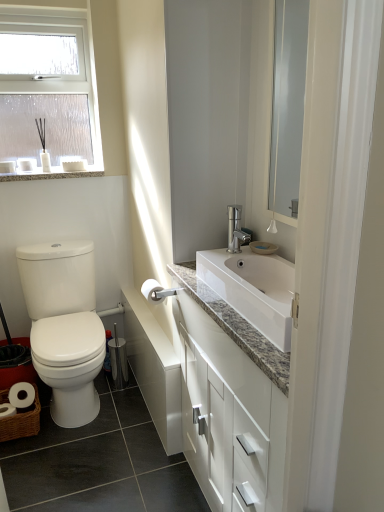
Question: From the image's perspective, is frosted glass window at upper left located beneath granite countertop at upper left?

Choices:
 (A) yes
 (B) no

Answer: (B)

Question: Considering the relative positions of frosted glass window at upper left and granite countertop at upper left in the image provided, is frosted glass window at upper left to the right of granite countertop at upper left from the viewer's perspective?

Choices:
 (A) no
 (B) yes

Answer: (A)

Question: Is there a large distance between frosted glass window at upper left and granite countertop at upper left?

Choices:
 (A) no
 (B) yes

Answer: (A)

Question: Can you confirm if frosted glass window at upper left is taller than granite countertop at upper left?

Choices:
 (A) yes
 (B) no

Answer: (A)

Question: Does frosted glass window at upper left turn towards granite countertop at upper left?

Choices:
 (A) yes
 (B) no

Answer: (A)

Question: Considering the positions of point (91, 288) and point (248, 374), is point (91, 288) closer or farther from the camera than point (248, 374)?

Choices:
 (A) farther
 (B) closer

Answer: (A)

Question: From their relative heights in the image, would you say white glossy toilet at left is taller or shorter than white glossy cabinet at center?

Choices:
 (A) short
 (B) tall

Answer: (A)

Question: Is white glossy toilet at left to the left or to the right of white glossy cabinet at center in the image?

Choices:
 (A) right
 (B) left

Answer: (B)

Question: Looking at their shapes, would you say white glossy toilet at left is wider or thinner than white glossy cabinet at center?

Choices:
 (A) wide
 (B) thin

Answer: (A)

Question: Considering their positions, is granite countertop at upper left located in front of or behind white glossy toilet at left?

Choices:
 (A) behind
 (B) front

Answer: (A)

Question: From a real-world perspective, is granite countertop at upper left physically located above or below white glossy toilet at left?

Choices:
 (A) below
 (B) above

Answer: (B)

Question: Choose the correct answer: Is granite countertop at upper left inside white glossy toilet at left or outside it?

Choices:
 (A) outside
 (B) inside

Answer: (A)

Question: From the image's perspective, is granite countertop at upper left above or below white glossy toilet at left?

Choices:
 (A) below
 (B) above

Answer: (B)

Question: From the image's perspective, is white glossy toilet at left positioned above or below frosted glass window at upper left?

Choices:
 (A) above
 (B) below

Answer: (B)

Question: Is point (71, 286) positioned closer to the camera than point (52, 118)?

Choices:
 (A) farther
 (B) closer

Answer: (B)